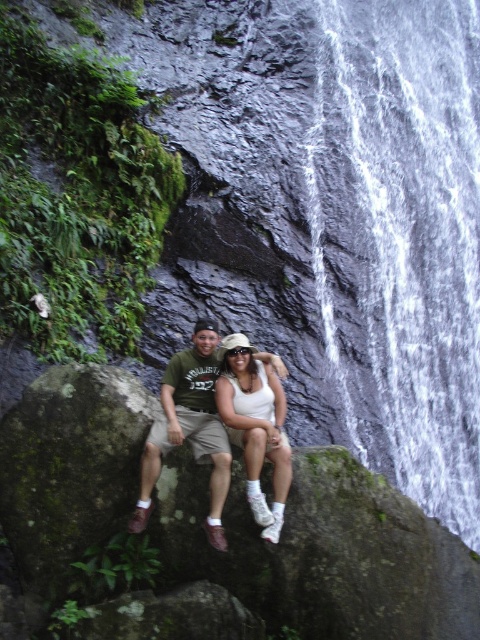
You are standing at the edge of the waterfall and want to take a photo of the white frothy water at center and the matte khaki shorts at center. Which object should you focus on first if you want to capture both in one frame without moving the camera?

You should focus on the matte khaki shorts at center first because the white frothy water at center is to the right of it, so adjusting the camera to include both would require ensuring the shorts are centered before including the water to the right.

You are a photographer trying to capture the perfect shot of the scene. You notice the matte khaki shorts at center in the image. Can you determine if the shorts are positioned closer to the top or bottom of the frame?

The position of matte khaki shorts at center is at point (190, 428). Since the y coordinate is 0.396, which is closer to the bottom of the frame, the shorts are positioned closer to the bottom.